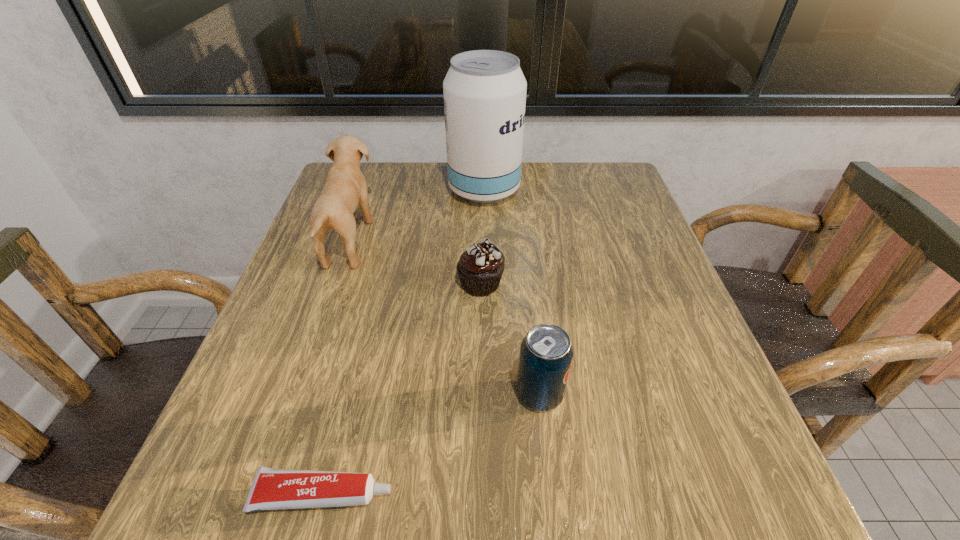
Locate an element on the screen. The height and width of the screenshot is (540, 960). free space that satisfies the following two spatial constraints: 1. on the left side of the second tallest object; 2. on the left side of the second nearest object is located at coordinates (297, 394).

This screenshot has height=540, width=960. What are the coordinates of `free spot that satisfies the following two spatial constraints: 1. on the front side of the cupcake; 2. on the left side of the fourth farthest object` in the screenshot? It's located at (481, 394).

Identify the location of vacant space that satisfies the following two spatial constraints: 1. on the front side of the fourth tallest object; 2. on the left side of the soda can. (481, 394).